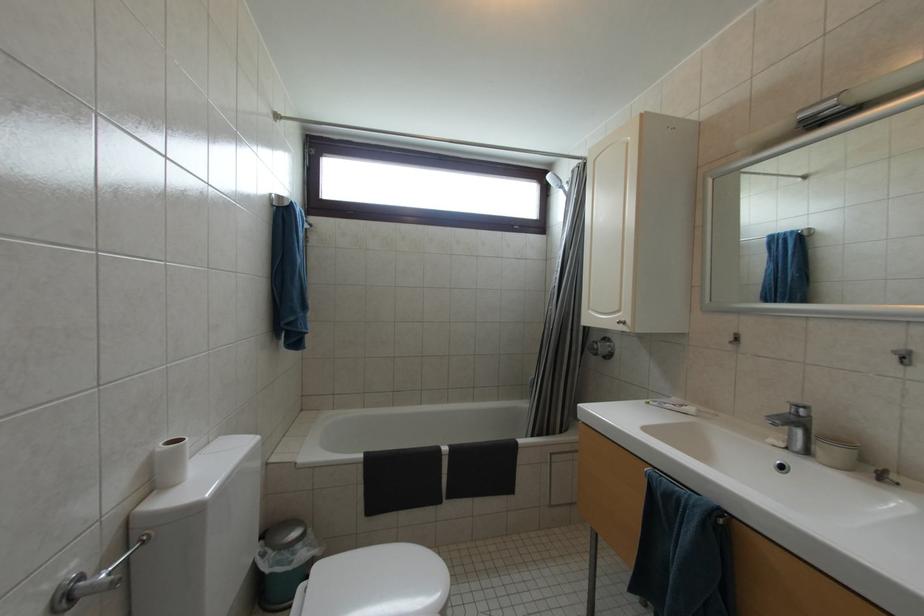
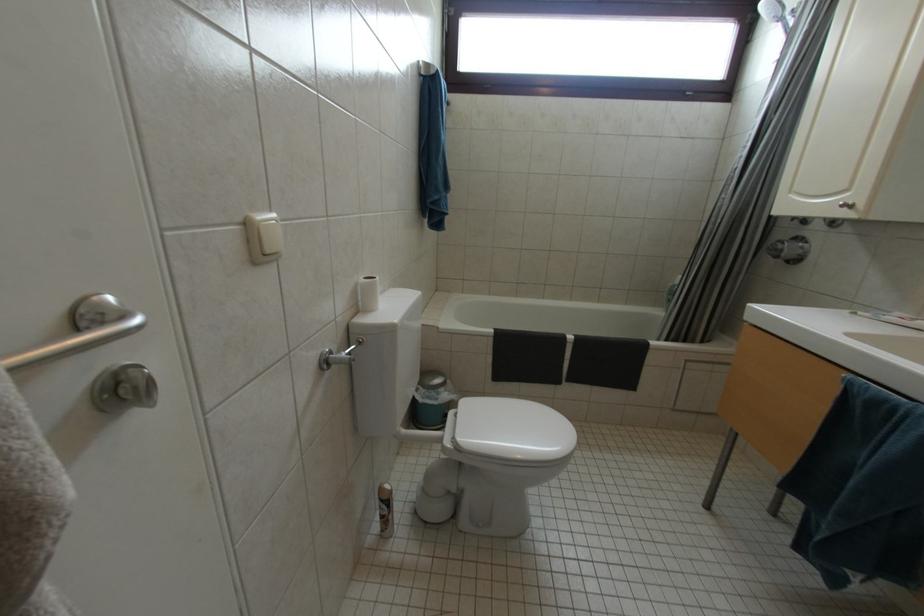
Based on the continuous images, in which direction is the camera rotating?

The camera rotated toward left-down.